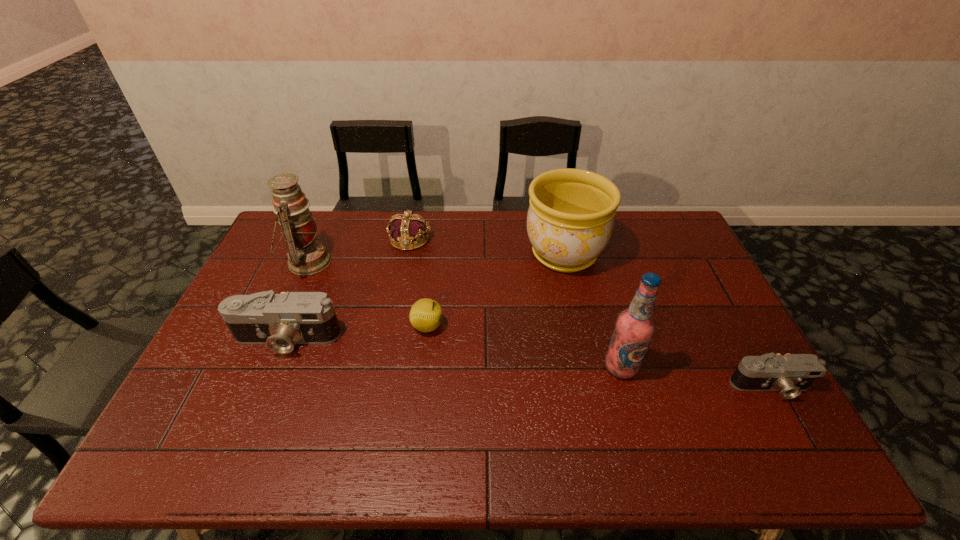
The height and width of the screenshot is (540, 960). Identify the location of the farther camera. (282, 320).

Identify the location of the taller camera. (282, 320).

You are a GUI agent. You are given a task and a screenshot of the screen. Output one action in this format:
    pyautogui.click(x=<x>, y=<y>)
    Task: Click on the shorter camera
    
    Given the screenshot: What is the action you would take?
    pyautogui.click(x=790, y=374)

At what (x,y) coordinates should I click in order to perform the action: click on the right camera. Please return your answer as a coordinate pair (x, y). The width and height of the screenshot is (960, 540). Looking at the image, I should click on (790, 374).

The image size is (960, 540). In order to click on the fifth shortest object in this screenshot , I will do `click(570, 219)`.

Find the location of `the fifth tallest object`. the fifth tallest object is located at coordinates (407, 227).

Locate an element on the screen. Image resolution: width=960 pixels, height=540 pixels. softball is located at coordinates (426, 315).

Identify the location of oil lamp. (306, 255).

At what (x,y) coordinates should I click in order to perform the action: click on alcohol. Please return your answer as a coordinate pair (x, y). Image resolution: width=960 pixels, height=540 pixels. Looking at the image, I should click on (635, 327).

Identify the location of vacant space situated 0.050m on the lens of the left camera. (273, 374).